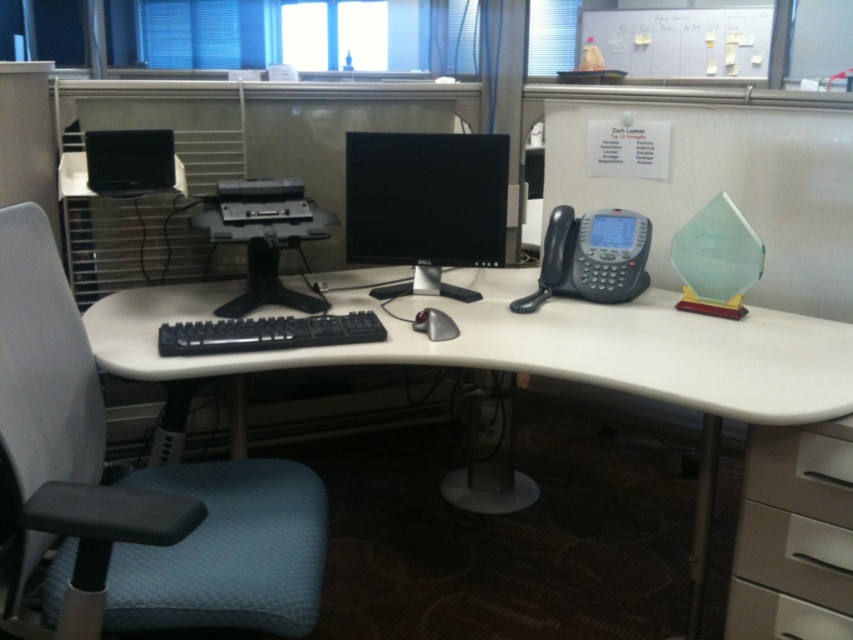
Question: Can you confirm if black glossy monitor at center is bigger than silver metallic mouse at center?

Choices:
 (A) yes
 (B) no

Answer: (A)

Question: Does blue fabric swivel chair at left have a greater width compared to black plastic desktop computer at center?

Choices:
 (A) no
 (B) yes

Answer: (B)

Question: Which point is closer to the camera taking this photo?

Choices:
 (A) (776, 580)
 (B) (260, 323)
 (C) (41, 532)

Answer: (C)

Question: Can you confirm if black glossy monitor at center is positioned to the right of black plastic desktop computer at center?

Choices:
 (A) no
 (B) yes

Answer: (B)

Question: Which point is farther to the camera?

Choices:
 (A) (482, 316)
 (B) (245, 300)
 (C) (445, 323)

Answer: (B)

Question: Which of the following is the farthest from the observer?

Choices:
 (A) (x=311, y=337)
 (B) (x=761, y=586)
 (C) (x=824, y=355)

Answer: (A)